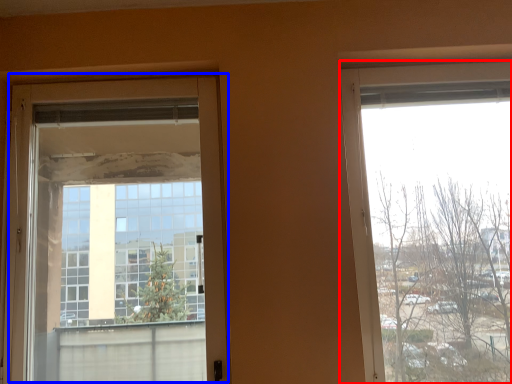
Question: Which point is further to the camera, window (highlighted by a red box) or door (highlighted by a blue box)?

Choices:
 (A) window
 (B) door

Answer: (B)